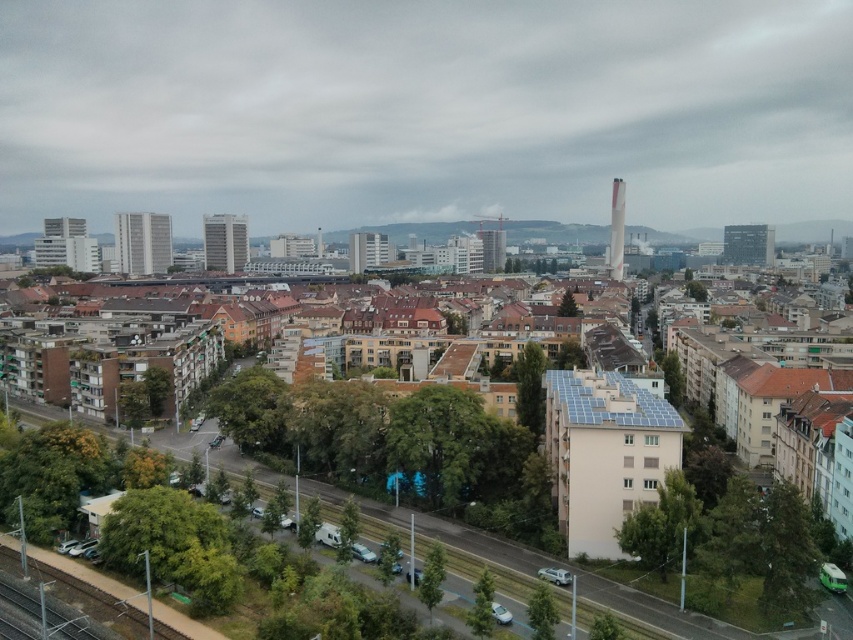
You are standing at the point marked by the coordinates point (91,600) in the cityscape image. What object are you standing on?

You are standing on the green metallic train track at lower left indicated by point (91,600).

You are a delivery drone flying over the city. You need to deliver a package to the matte glass building at center. However, you notice the white glossy building at upper left is blocking your direct path. Can you fly around it to reach your destination?

The white glossy building at upper left is in front of the matte glass building at center, so you can fly around it to reach the matte glass building at center.